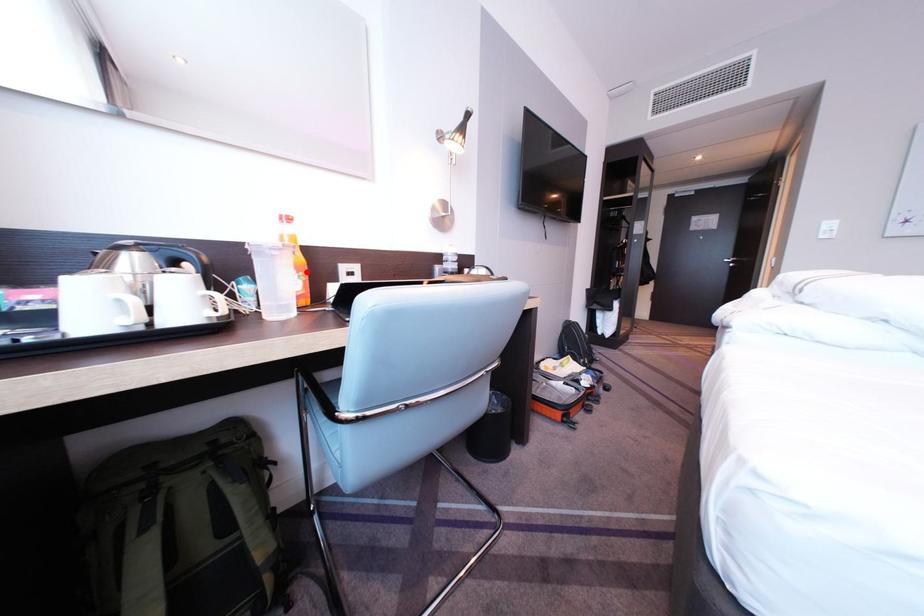
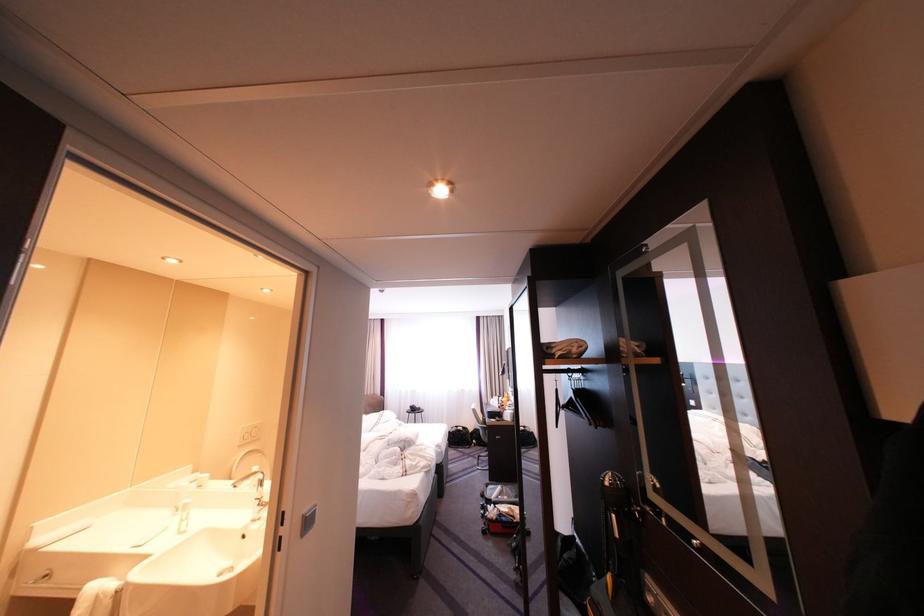
Question: I am providing you with two images of the same scene from different viewpoints. A red point is marked on the first image. Is the red point's position out of view in image 2?

Choices:
 (A) Yes
 (B) No

Answer: (A)